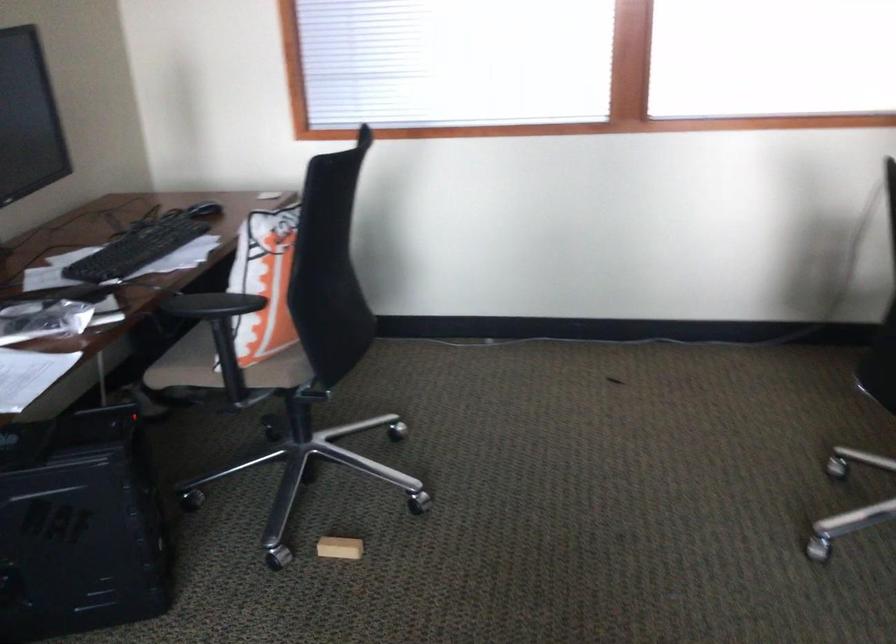
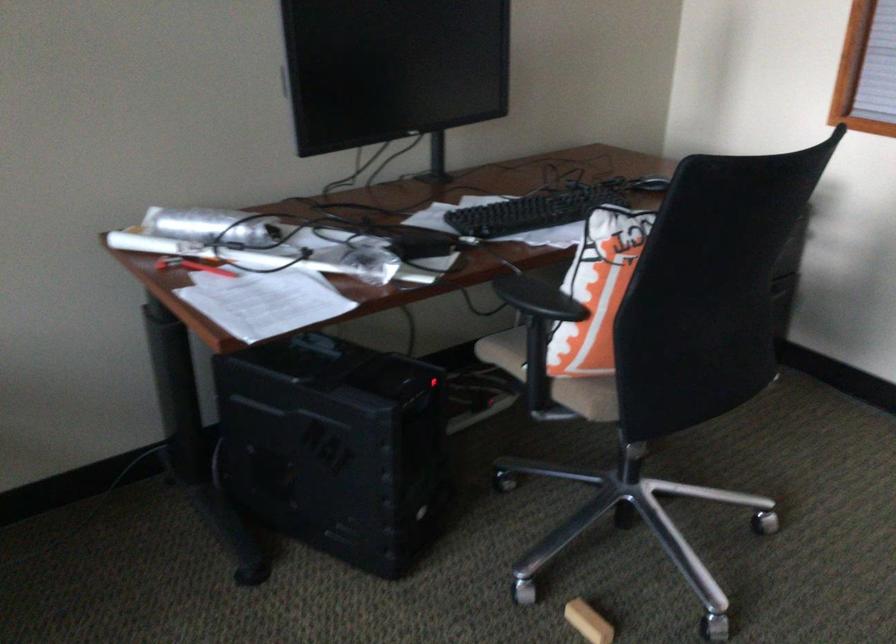
Where in the second image is the point corresponding to (x=273, y=277) from the first image?

(597, 290)